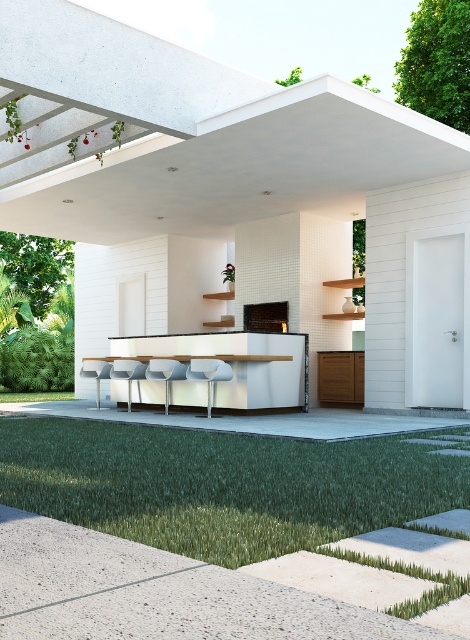
Which of these two, white concrete pergola at upper center or green grass at lower center, stands taller?

white concrete pergola at upper center is taller.

The height and width of the screenshot is (640, 470). I want to click on white concrete pergola at upper center, so click(x=239, y=188).

You are a GUI agent. You are given a task and a screenshot of the screen. Output one action in this format:
    pyautogui.click(x=<x>, y=<y>)
    Task: Click on the white concrete pergola at upper center
    Image resolution: width=470 pixels, height=640 pixels.
    Given the screenshot: What is the action you would take?
    pyautogui.click(x=239, y=188)

I want to click on white concrete pergola at upper center, so click(239, 188).